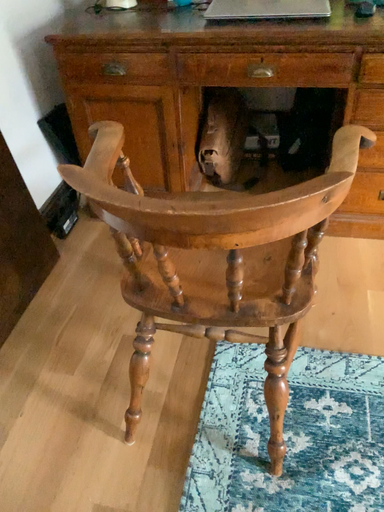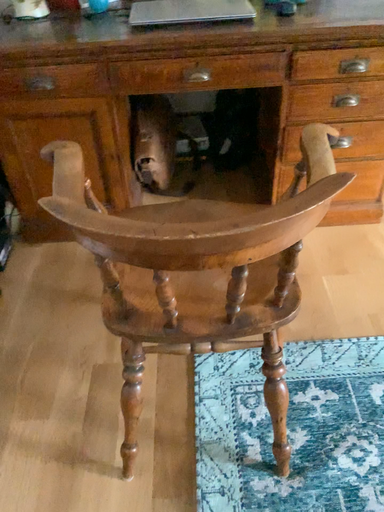
Question: Which way did the camera rotate in the video?

Choices:
 (A) rotated left
 (B) rotated right

Answer: (B)